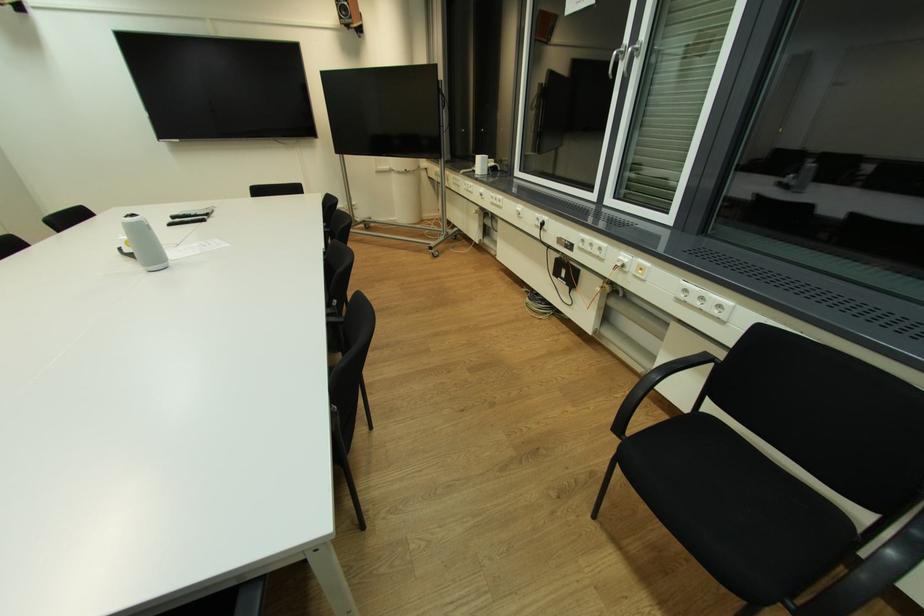
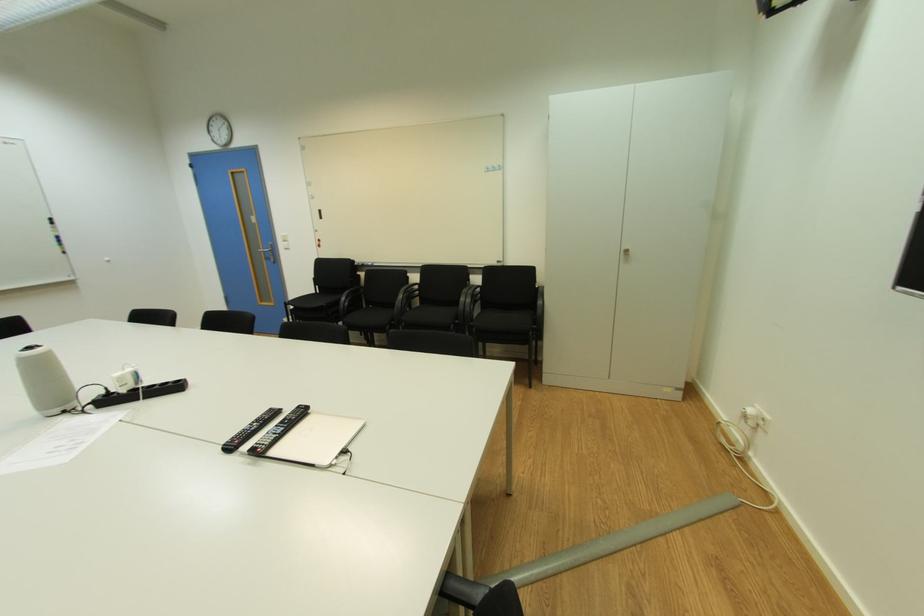
The point at (137,216) is marked in the first image. Where is the corresponding point in the second image?

(34, 349)